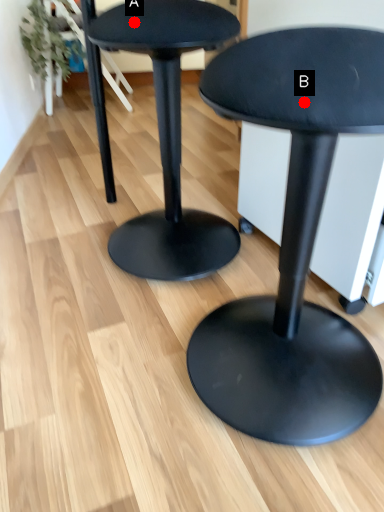
Question: Two points are circled on the image, labeled by A and B beside each circle. Which point appears closest to the camera in this image?

Choices:
 (A) A is closer
 (B) B is closer

Answer: (B)